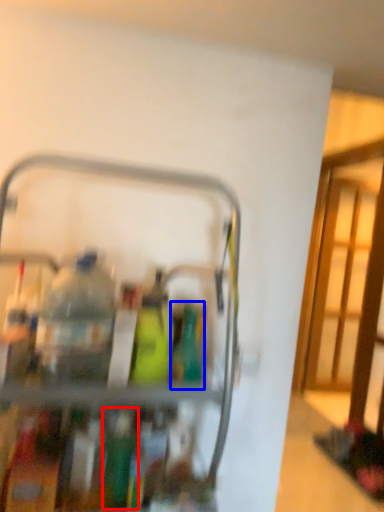
Question: Which object is further to the camera taking this photo, bottle (highlighted by a red box) or bottle (highlighted by a blue box)?

Choices:
 (A) bottle
 (B) bottle

Answer: (B)